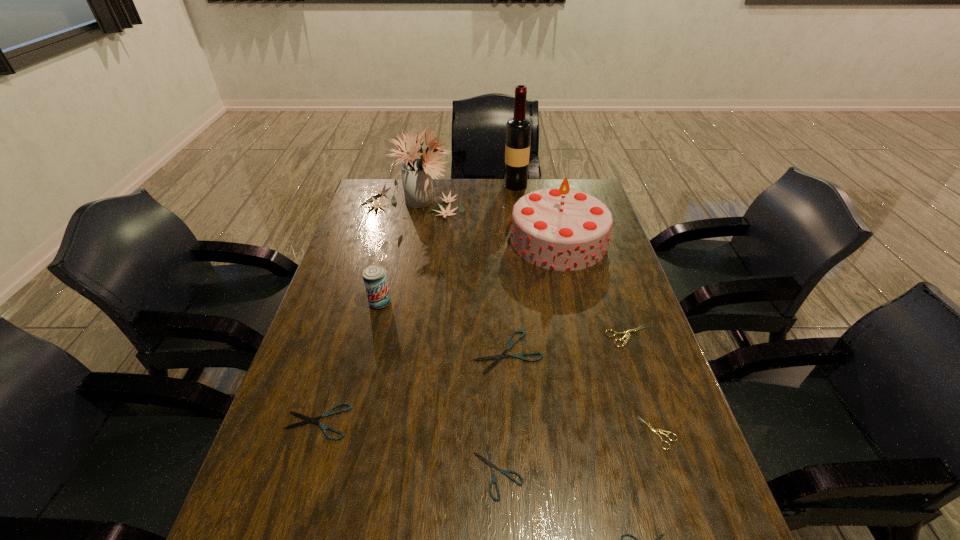
Locate an element on the screen. Image resolution: width=960 pixels, height=540 pixels. free space at the right edge of the desktop is located at coordinates pos(674,485).

This screenshot has height=540, width=960. I want to click on free region at the far right corner of the desktop, so click(556, 184).

Locate an element on the screen. This screenshot has width=960, height=540. unoccupied area between the third tallest object and the farther beige shears is located at coordinates (593, 288).

You are a GUI agent. You are given a task and a screenshot of the screen. Output one action in this format:
    pyautogui.click(x=<x>, y=<y>)
    Task: Click on the free space between the second farthest black shears and the biggest black shears
    The image size is (960, 540).
    Given the screenshot: What is the action you would take?
    pyautogui.click(x=413, y=387)

Identify the location of vacant space that is in between the farthest black shears and the tallest object. (512, 268).

Locate an element on the screen. Image resolution: width=960 pixels, height=540 pixels. vacant region between the second farthest black shears and the smaller beige shears is located at coordinates (488, 427).

Identify the location of free spot between the fourth tallest object and the wine bottle. This screenshot has height=540, width=960. (447, 244).

Where is `unoccupied position between the birthday cake and the farther beige shears`? The height and width of the screenshot is (540, 960). unoccupied position between the birthday cake and the farther beige shears is located at coordinates (593, 288).

Locate an element on the screen. Image resolution: width=960 pixels, height=540 pixels. object that stands as the eighth closest to the eighth shortest object is located at coordinates (308, 419).

Locate which object ranks in proximity to the second tallest object. Please provide its 2D coordinates. Your answer should be formatted as a tuple, i.e. [(x, y)], where the tuple contains the x and y coordinates of a point satisfying the conditions above.

[(518, 129)]